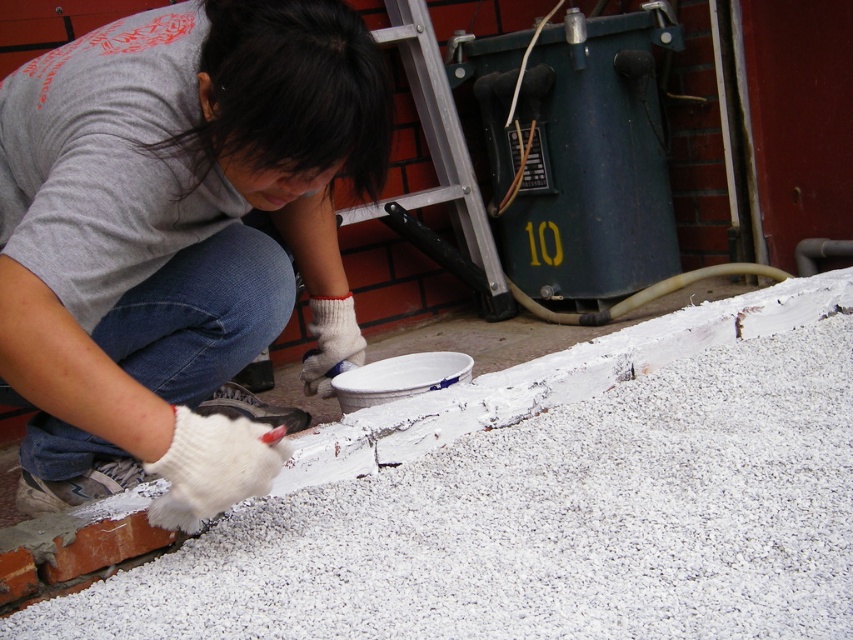
You are a construction worker who needs to place a small tool exactly at the center of the white granular gravel at center. According to the coordinates provided, where should you place the tool?

The tool should be placed at point coordinates (546, 500) since that is the center position of the white granular gravel at center.

You are a painter who needs to reach the point at coordinates (177,237). Which object in the scene is located at that point?

The point at coordinates (177,237) is on the white matte paintbrush at lower center.

You are a painter who needs to reach the ceiling to touch up some paint. You have a white matte paintbrush at lower center and a brushed metal ladder at upper center. How far apart are these two items?

The white matte paintbrush at lower center and the brushed metal ladder at upper center are 1.06 meters apart from each other.